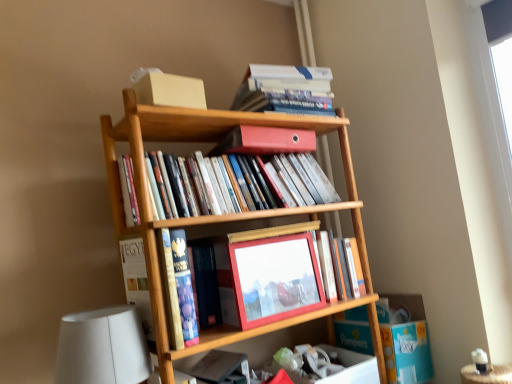
Question: From a real-world perspective, is hardcover book at upper center, which is counted as the 6th book, starting from the bottom, positioned above or below matte wooden frame at center, placed as the third book when sorted from bottom to top?

Choices:
 (A) above
 (B) below

Answer: (A)

Question: Is point (312, 87) closer or farther from the camera than point (322, 256)?

Choices:
 (A) closer
 (B) farther

Answer: (B)

Question: Based on their relative distances, which object is nearer to the hardcover book at center, acting as the second book starting from the bottom?

Choices:
 (A) matte plastic binder at center, which appears as the fourth book when ordered from the bottom
 (B) matte black book at lower center, which is the first book in bottom-to-top order
 (C) hardcover book at upper center, which is counted as the 6th book, starting from the bottom
 (D) matte plastic folder at upper center, arranged as the fifth book when ordered from the bottom
 (E) matte wooden frame at center, which appears as the fourth book when viewed from the top

Answer: (A)

Question: Which of these objects is positioned farthest from the matte wooden frame at center, which appears as the fourth book when viewed from the top?

Choices:
 (A) matte plastic binder at center, which appears as the fourth book when ordered from the bottom
 (B) hardcover book at upper center, which is counted as the 6th book, starting from the bottom
 (C) white matte table lamp at lower left
 (D) matte red picture frame at center
 (E) matte plastic folder at upper center, which appears as the 2th book when viewed from the top

Answer: (C)